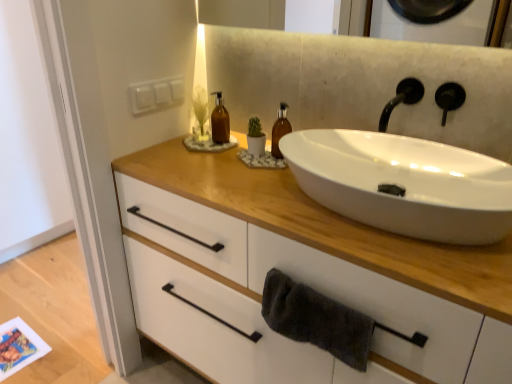
Where is `free point above white matte cabinet at center (from a real-world perspective)`? This screenshot has width=512, height=384. free point above white matte cabinet at center (from a real-world perspective) is located at coordinates (287, 195).